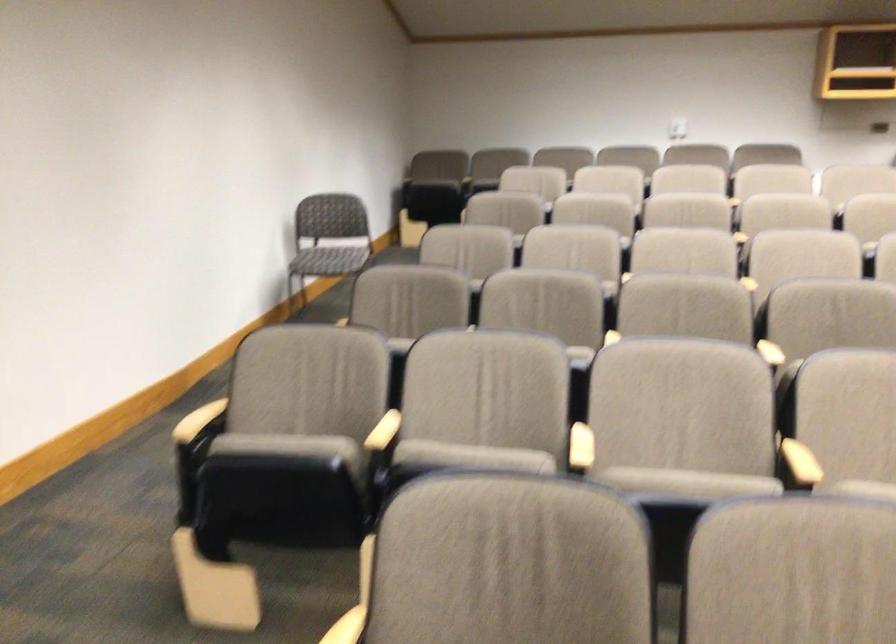
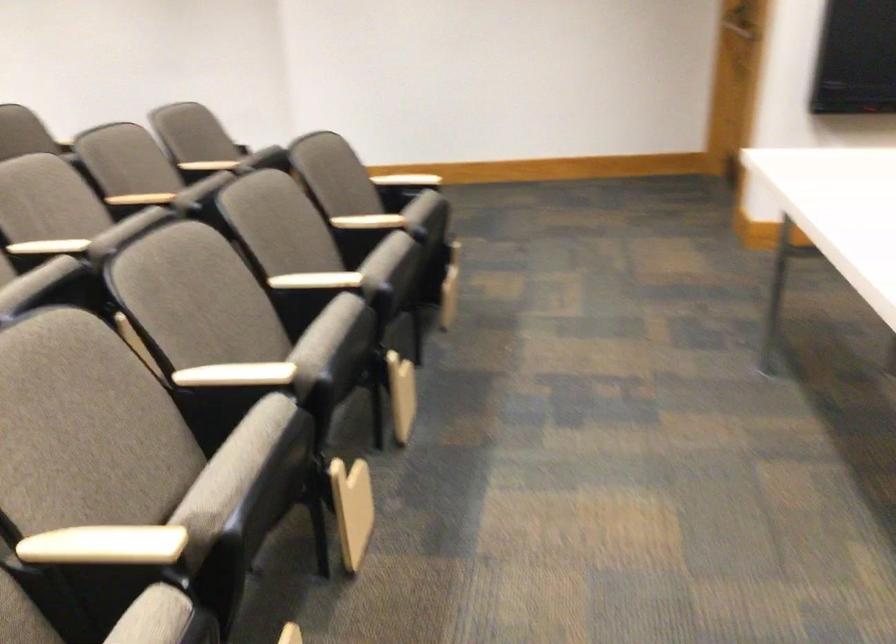
Based on the continuous images, in which direction is the camera rotating?

The camera's rotation is toward right-down.